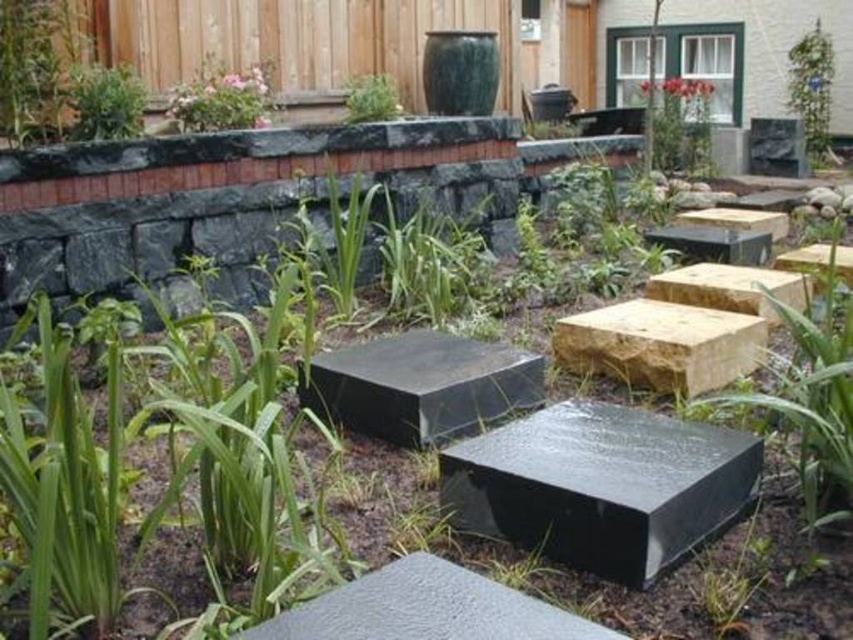
You are a gardener standing at the bottom of the stone steps. You notice two green leafy plants in the garden bed above. Which plant is closer to the wooden fence, the green leafy plant at upper left or the green leafy plant at upper center?

The green leafy plant at upper left is positioned under the green leafy plant at upper center, so the green leafy plant at upper center is closer to the wooden fence.

You are standing at the bottom of the stone steps in the garden. You notice a yellow stone at center. Which direction should you move to reach it from your current position?

The yellow stone at center is located at point coordinates that are further along the horizontal axis towards the center of the scene. Since you are at the bottom of the steps, moving towards the center horizontally should lead you to the yellow stone at center.

You are designing a garden layout and need to place a small decorative item between the yellow stone at center and the green leafy plant at upper left. Which object should you place the item closer to to ensure it doesn

The yellow stone at center is larger than the green leafy plant at upper left, so placing the item closer to the yellow stone at center would maintain a balanced arrangement.